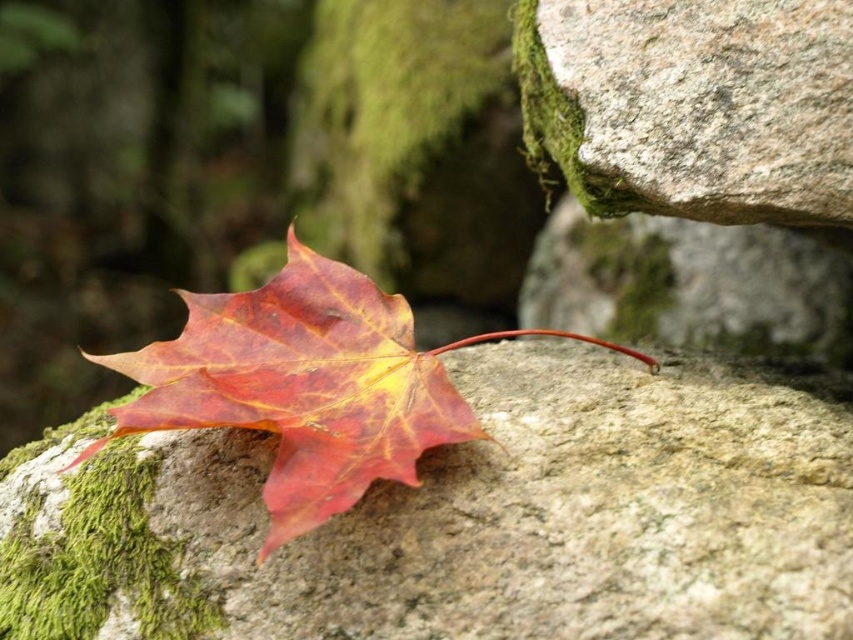
Between point (331, 275) and point (602, 234), which one is positioned in front?

Point (331, 275)

Is point (363, 426) farther from viewer compared to point (764, 225)?

No, it is in front of (764, 225).

Where is `shiny red maple leaf at center`? The image size is (853, 640). shiny red maple leaf at center is located at coordinates (306, 385).